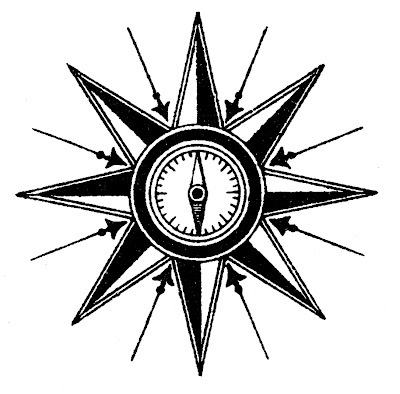
The width and height of the screenshot is (400, 394). Identify the location of black circle in the center of the clock hands. (198, 193).